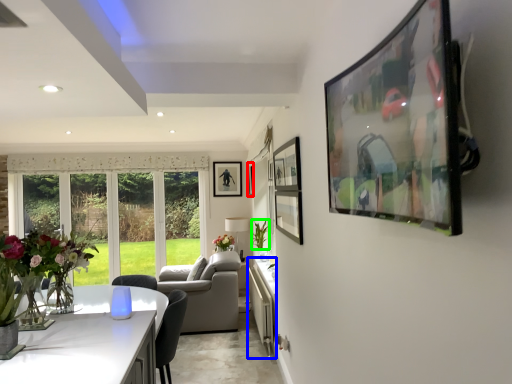
Question: Which object is positioned closest to picture frame (highlighted by a red box)? Select from counter top (highlighted by a blue box) and plant (highlighted by a green box).

Choices:
 (A) counter top
 (B) plant

Answer: (B)